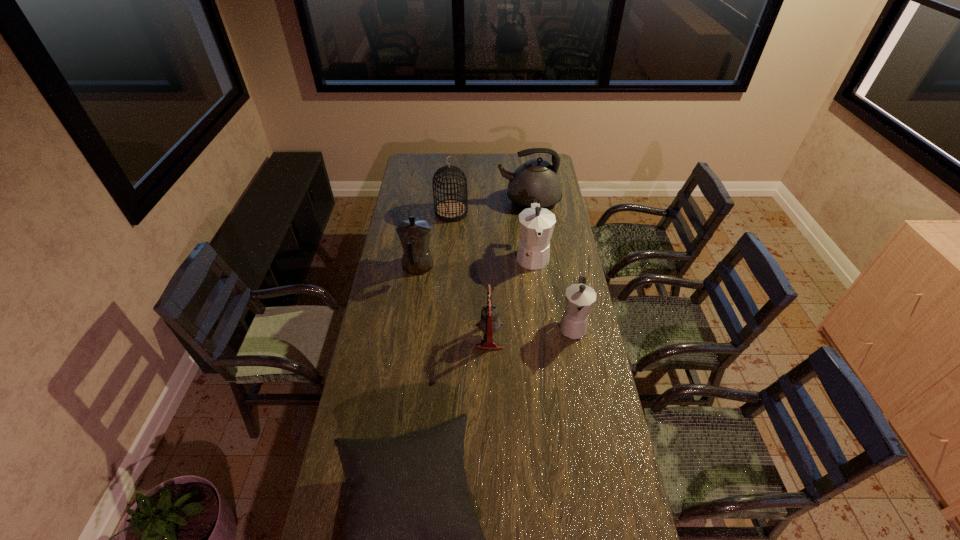
Locate an element on the screen. This screenshot has width=960, height=540. birdcage is located at coordinates (450, 210).

Identify the location of kettle. (537, 179).

You are a GUI agent. You are given a task and a screenshot of the screen. Output one action in this format:
    pyautogui.click(x=<x>, y=<y>)
    Task: Click on the leftmost coffeepot
    The height and width of the screenshot is (540, 960).
    Given the screenshot: What is the action you would take?
    pyautogui.click(x=414, y=234)

Locate an element on the screen. The height and width of the screenshot is (540, 960). the nearest coffeepot is located at coordinates (580, 298).

Find the location of a particular element. The image size is (960, 540). bell is located at coordinates (489, 323).

The image size is (960, 540). In order to click on free space located on the right of the birdcage in this screenshot , I will do `click(530, 212)`.

I want to click on free space located at the spout of the kettle, so click(460, 200).

I want to click on vacant space located at the spout of the kettle, so click(462, 200).

Identify the location of blank space located at the spout of the kettle. This screenshot has width=960, height=540. (476, 200).

What are the coordinates of `vacant space located 0.060m on the pouring side of the leftmost coffeepot` in the screenshot? It's located at (421, 241).